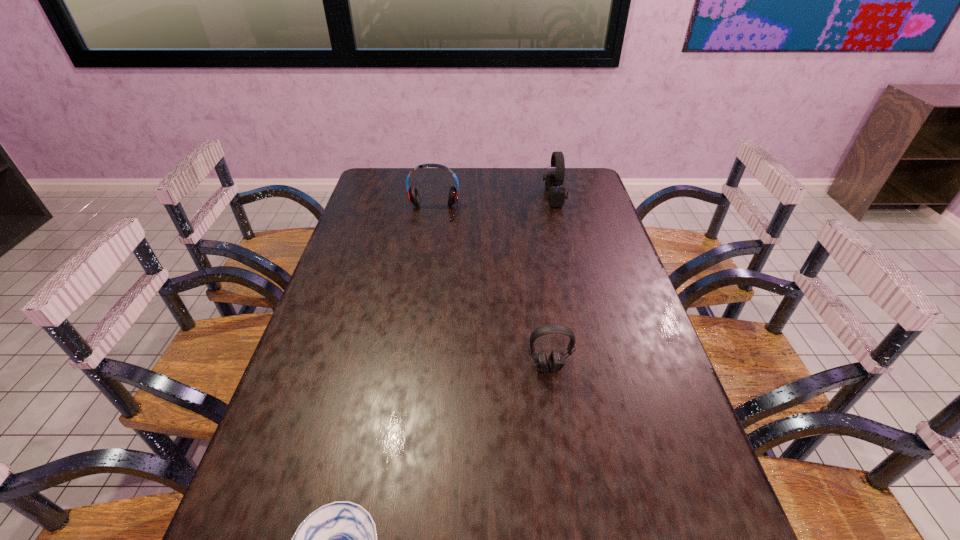
I want to click on object at the right edge, so click(556, 195).

This screenshot has height=540, width=960. I want to click on object positioned at the far right corner, so click(x=556, y=195).

Where is `free space at the far edge of the desktop`? This screenshot has width=960, height=540. free space at the far edge of the desktop is located at coordinates (475, 167).

This screenshot has height=540, width=960. In order to click on vacant region at the left edge of the desktop in this screenshot , I will do `click(360, 202)`.

Image resolution: width=960 pixels, height=540 pixels. Find the location of `vacant region at the right edge of the desktop`. vacant region at the right edge of the desktop is located at coordinates (632, 359).

Identify the location of free space at the far left corner of the desktop. (376, 197).

Identify the location of vacant area between the second headset from right to left and the leftmost headset. The height and width of the screenshot is (540, 960). (491, 289).

Locate an element on the screen. The height and width of the screenshot is (540, 960). free spot between the leftmost headset and the second object from right to left is located at coordinates (491, 289).

The image size is (960, 540). Find the location of `empty space that is in between the leftmost headset and the second headset from left to right`. empty space that is in between the leftmost headset and the second headset from left to right is located at coordinates (491, 289).

Image resolution: width=960 pixels, height=540 pixels. In order to click on unoccupied area between the third farthest object and the rightmost headset in this screenshot , I will do `click(551, 282)`.